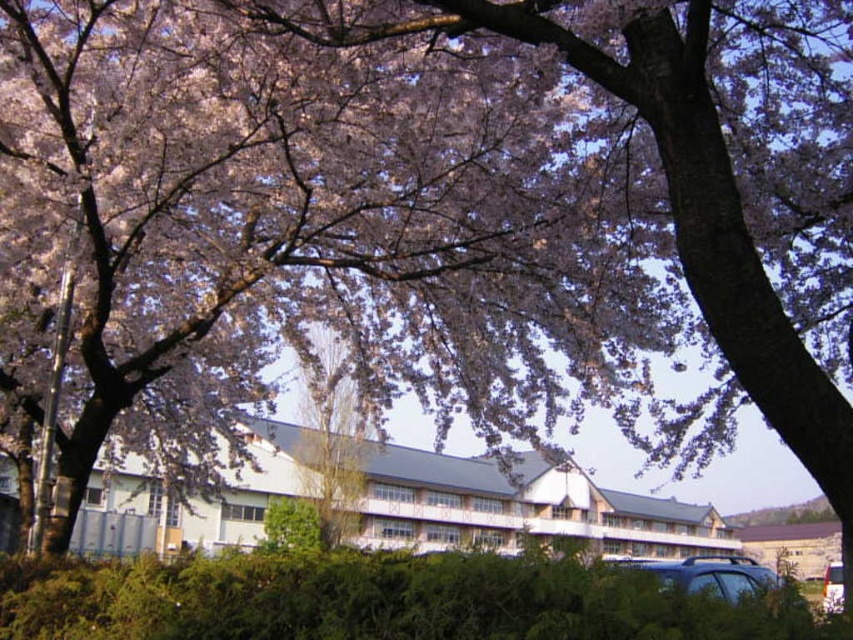
From the picture: Does matte black car at lower right have a greater width compared to white glossy van at lower right?

No.

Who is higher up, matte black car at lower right or white glossy van at lower right?

white glossy van at lower right is higher up.

The image size is (853, 640). Describe the element at coordinates (706, 573) in the screenshot. I see `matte black car at lower right` at that location.

Locate an element on the screen. matte black car at lower right is located at coordinates (706, 573).

Is green leafy hedge at lower center wider than matte black car at lower right?

No, green leafy hedge at lower center is not wider than matte black car at lower right.

Measure the distance between point (358, 586) and camera.

3.92 meters

What do you see at coordinates (376, 600) in the screenshot? I see `green leafy hedge at lower center` at bounding box center [376, 600].

Find the location of a particular element. The width and height of the screenshot is (853, 640). green leafy hedge at lower center is located at coordinates (376, 600).

Is point (744, 632) closer to viewer compared to point (842, 600)?

Yes, it is.

Which of these two, green leafy hedge at lower center or white glossy van at lower right, stands shorter?

With less height is green leafy hedge at lower center.

This screenshot has width=853, height=640. In order to click on green leafy hedge at lower center in this screenshot , I will do tap(376, 600).